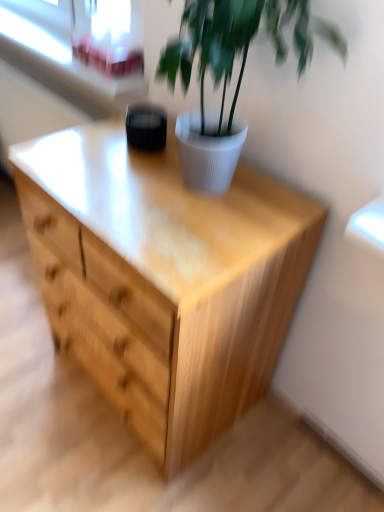
Question: Does natural wood chest of drawers at center appear on the right side of transparent glass window screen at upper left?

Choices:
 (A) yes
 (B) no

Answer: (A)

Question: Are natural wood chest of drawers at center and transparent glass window screen at upper left beside each other?

Choices:
 (A) no
 (B) yes

Answer: (A)

Question: From a real-world perspective, is natural wood chest of drawers at center on top of transparent glass window screen at upper left?

Choices:
 (A) yes
 (B) no

Answer: (B)

Question: Can you confirm if natural wood chest of drawers at center is wider than transparent glass window screen at upper left?

Choices:
 (A) yes
 (B) no

Answer: (A)

Question: Is natural wood chest of drawers at center positioned beyond the bounds of transparent glass window screen at upper left?

Choices:
 (A) yes
 (B) no

Answer: (A)

Question: Is point (119, 12) closer or farther from the camera than point (9, 9)?

Choices:
 (A) closer
 (B) farther

Answer: (A)

Question: Do you think transparent glass window screen at upper left is within white plastic window frame at upper left, or outside of it?

Choices:
 (A) inside
 (B) outside

Answer: (B)

Question: Considering the positions of transparent glass window screen at upper left and white plastic window frame at upper left in the image, is transparent glass window screen at upper left taller or shorter than white plastic window frame at upper left?

Choices:
 (A) short
 (B) tall

Answer: (B)

Question: Based on their sizes in the image, would you say transparent glass window screen at upper left is bigger or smaller than white plastic window frame at upper left?

Choices:
 (A) small
 (B) big

Answer: (A)

Question: Is white plastic window frame at upper left taller or shorter than white ribbed pot at upper center?

Choices:
 (A) tall
 (B) short

Answer: (B)

Question: Considering their positions, is white plastic window frame at upper left located in front of or behind white ribbed pot at upper center?

Choices:
 (A) front
 (B) behind

Answer: (B)

Question: From the image's perspective, is white plastic window frame at upper left positioned above or below white ribbed pot at upper center?

Choices:
 (A) above
 (B) below

Answer: (A)

Question: Does point (74, 18) appear closer or farther from the camera than point (228, 65)?

Choices:
 (A) farther
 (B) closer

Answer: (A)

Question: Based on their sizes in the image, would you say white ribbed pot at upper center is bigger or smaller than white plastic window frame at upper left?

Choices:
 (A) big
 (B) small

Answer: (A)

Question: Is white ribbed pot at upper center wider or thinner than white plastic window frame at upper left?

Choices:
 (A) thin
 (B) wide

Answer: (B)